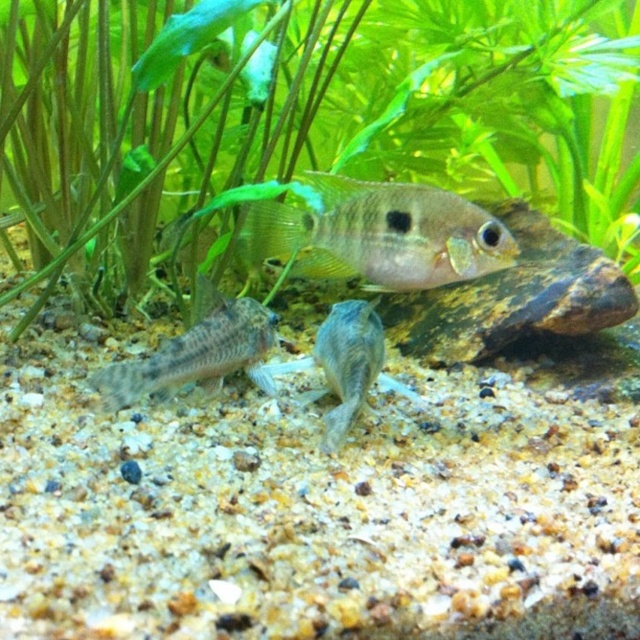
Is shiny silver fish at center to the left of translucent gray fish at center from the viewer's perspective?

Incorrect, shiny silver fish at center is not on the left side of translucent gray fish at center.

Is point (449, 264) positioned in front of point (349, 339)?

Yes, it is in front of point (349, 339).

Is point (314, 272) closer to viewer compared to point (355, 314)?

Yes, it is in front of point (355, 314).

Where is `shiny silver fish at center`? This screenshot has height=640, width=640. shiny silver fish at center is located at coordinates (380, 234).

Is green leafy plant at upper center smaller than translucent gray fish at center?

No.

Who is more forward, (608, 83) or (280, 371)?

Positioned in front is point (280, 371).

Which is behind, point (257, 154) or point (337, 429)?

The point (257, 154) is behind.

This screenshot has width=640, height=640. I want to click on green leafy plant at upper center, so click(364, 115).

Between point (323, 243) and point (266, 316), which one is positioned behind?

Positioned behind is point (266, 316).

Who is higher up, shiny silver fish at center or speckled gray gravel at lower left?

shiny silver fish at center

Is point (456, 220) farther from camera compared to point (244, 340)?

No, it is not.

Where is `shiny silver fish at center`? The width and height of the screenshot is (640, 640). shiny silver fish at center is located at coordinates (380, 234).